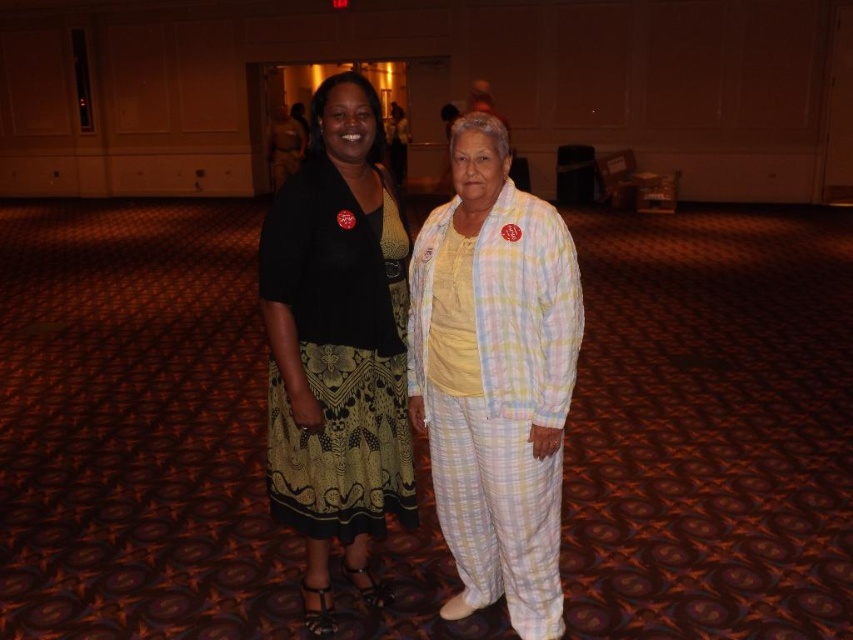
You are a photographer at a formal event. You need to capture a clear shot of both the matte black skirt at center and the black textured dress at center. Which one is positioned higher up in the image?

The matte black skirt at center is above the black textured dress at center, so it is positioned higher up in the image.